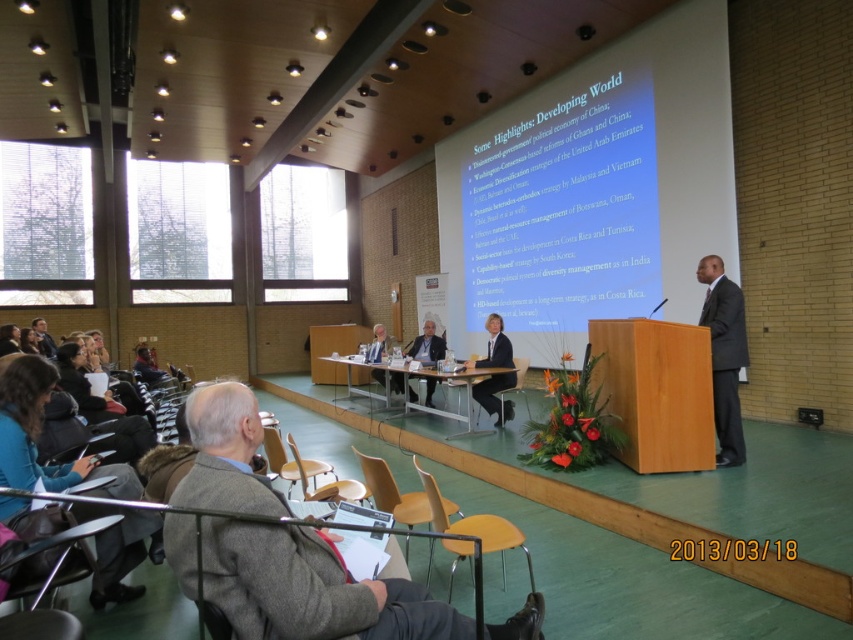
Question: Does dark suit at center have a larger size compared to light brown wood table at center?

Choices:
 (A) no
 (B) yes

Answer: (A)

Question: Estimate the real-world distances between objects in this image. Which object is closer to the dark suit at center?

Choices:
 (A) yellow plastic chair at lower center
 (B) white paper at upper center

Answer: (A)

Question: Is white paper at upper center closer to the viewer compared to light brown wood table at center?

Choices:
 (A) yes
 (B) no

Answer: (A)

Question: Which of the following is the closest to the observer?

Choices:
 (A) (109, 472)
 (B) (514, 381)
 (C) (489, 515)

Answer: (A)

Question: Can you confirm if light brown leather jacket at center is positioned to the right of yellow plastic chair at lower center?

Choices:
 (A) yes
 (B) no

Answer: (A)

Question: Which point is farther to the camera?

Choices:
 (A) (412, 456)
 (B) (277, 442)
 (C) (520, 384)
 (D) (339, 483)

Answer: (C)